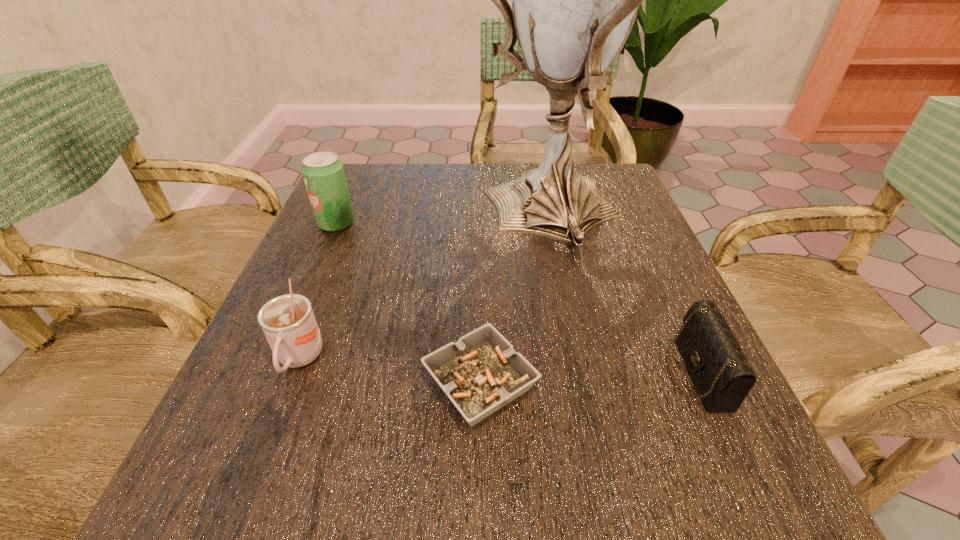
Image resolution: width=960 pixels, height=540 pixels. Identify the location of free space located 0.070m on the front flap of the clutch bag. (x=623, y=373).

You are a GUI agent. You are given a task and a screenshot of the screen. Output one action in this format:
    pyautogui.click(x=<x>, y=<y>)
    Task: Click on the free spot located on the front of the ashtray
    This screenshot has height=540, width=960.
    Given the screenshot: What is the action you would take?
    pyautogui.click(x=480, y=474)

Image resolution: width=960 pixels, height=540 pixels. What are the coordinates of `object located in the far edge section of the desktop` in the screenshot? It's located at (575, 0).

The width and height of the screenshot is (960, 540). I want to click on soda that is at the left edge, so tap(323, 173).

Locate an element on the screen. cup situated at the left edge is located at coordinates pyautogui.click(x=288, y=322).

Where is `trophy cup present at the right edge`? trophy cup present at the right edge is located at coordinates (575, 0).

Find the location of `clutch bag positioned at the right edge`. clutch bag positioned at the right edge is located at coordinates (722, 375).

What are the coordinates of `object that is at the far right corner` in the screenshot? It's located at (575, 0).

At what (x,y) coordinates should I click in order to perform the action: click on vacant area at the far edge. Please return your answer as a coordinate pair (x, y). The image size is (960, 540). Looking at the image, I should click on (478, 171).

This screenshot has height=540, width=960. Find the location of `free region at the near edge`. free region at the near edge is located at coordinates (483, 464).